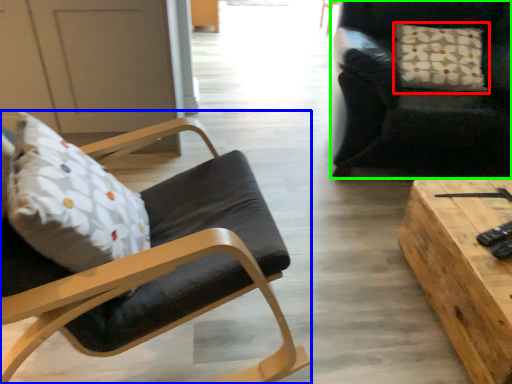
Question: Based on their relative distances, which object is nearer to pillow (highlighted by a red box)? Choose from chair (highlighted by a blue box) and chair (highlighted by a green box).

Choices:
 (A) chair
 (B) chair

Answer: (B)